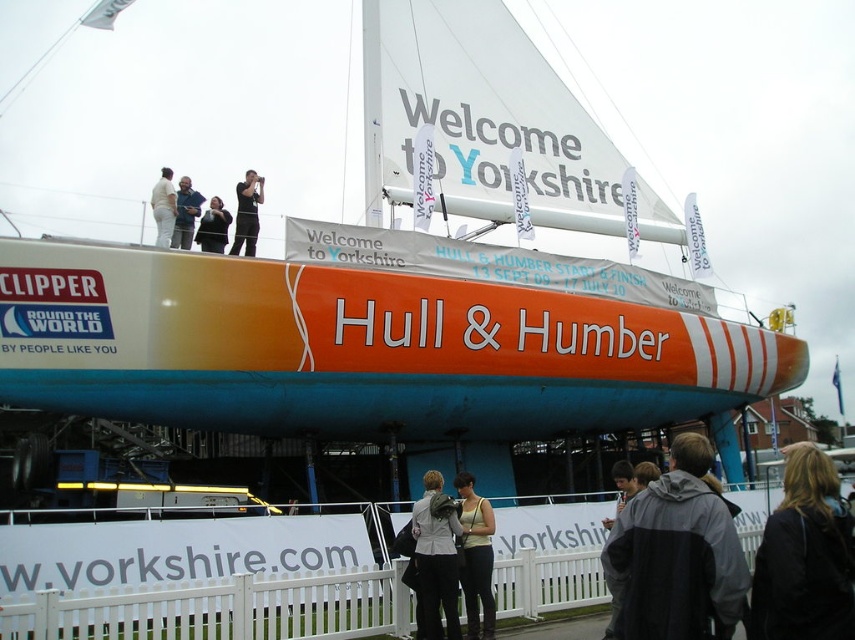
Is point (463, 545) less distant than point (248, 224)?

Yes, it is in front of point (248, 224).

Which of these two, light green tank top at center or black fabric at upper center, stands shorter?

light green tank top at center is shorter.

Which is in front, point (461, 493) or point (252, 234)?

Point (461, 493)

Image resolution: width=855 pixels, height=640 pixels. I want to click on light green tank top at center, so click(x=475, y=557).

Is orange matte hull at center wider than matte black jacket at upper center?

Indeed, orange matte hull at center has a greater width compared to matte black jacket at upper center.

Find the location of a particular element. orange matte hull at center is located at coordinates (181, 115).

Does point (16, 192) come behind point (198, 205)?

That is True.

You are a GUI agent. You are given a task and a screenshot of the screen. Output one action in this format:
    pyautogui.click(x=<x>, y=<y>)
    Task: Click on the orange matte hull at center
    
    Given the screenshot: What is the action you would take?
    pyautogui.click(x=181, y=115)

Is orange matte hull at center positioned before light gray fabric jacket at lower center?

No, orange matte hull at center is further to the viewer.

Image resolution: width=855 pixels, height=640 pixels. I want to click on orange matte hull at center, so click(x=181, y=115).

Identify the location of orange matte hull at center. The image size is (855, 640). (181, 115).

Locate an element on the screen. The width and height of the screenshot is (855, 640). orange matte hull at center is located at coordinates (181, 115).